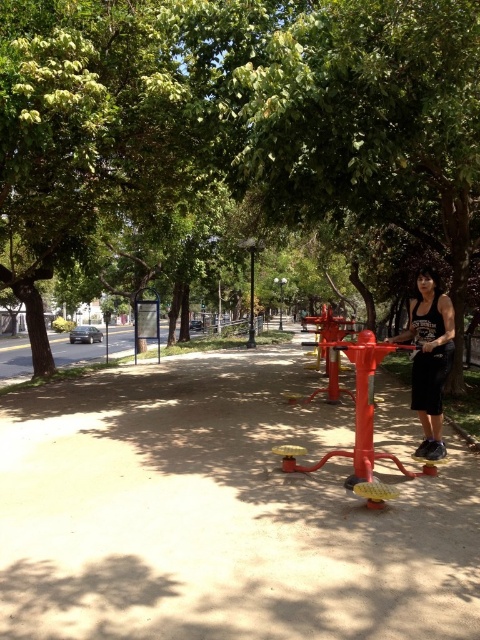
Question: Is matte concrete pavement at center to the right of black tank top at center from the viewer's perspective?

Choices:
 (A) yes
 (B) no

Answer: (B)

Question: Estimate the real-world distances between objects in this image. Which object is closer to the green leafy tree at center?

Choices:
 (A) black tank top at center
 (B) metallic pole at center
 (C) matte concrete pavement at center

Answer: (C)

Question: Can you confirm if black tank top at center is positioned to the left of metallic pole at center?

Choices:
 (A) yes
 (B) no

Answer: (B)

Question: Can you confirm if black tank top at center is positioned above metallic pole at center?

Choices:
 (A) no
 (B) yes

Answer: (A)

Question: Which of the following is the farthest from the observer?

Choices:
 (A) metallic pole at center
 (B) green leafy tree at center
 (C) black tank top at center
 (D) matte concrete pavement at center

Answer: (A)

Question: Estimate the real-world distances between objects in this image. Which object is farther from the black tank top at center?

Choices:
 (A) green leafy tree at center
 (B) matte concrete pavement at center

Answer: (A)